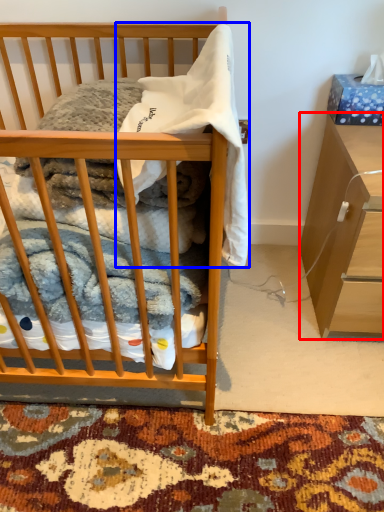
Question: Among these objects, which one is farthest to the camera, cabinetry (highlighted by a red box) or baby clothe (highlighted by a blue box)?

Choices:
 (A) cabinetry
 (B) baby clothe

Answer: (A)